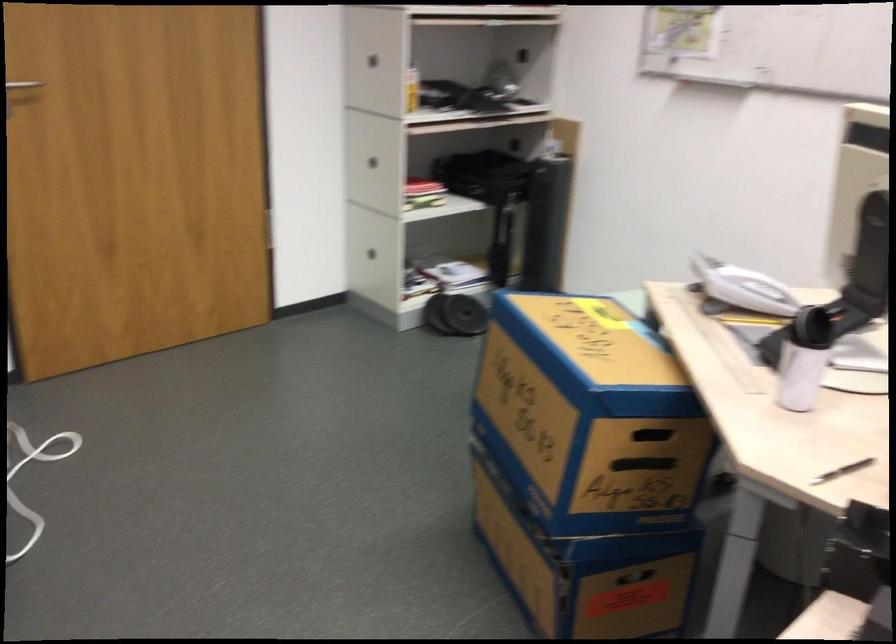
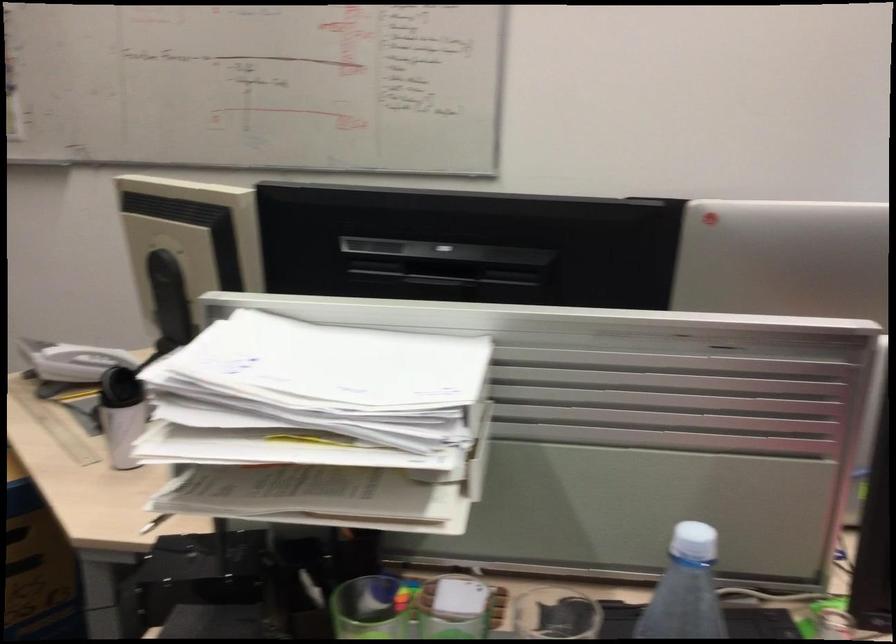
Where in the second image is the point corresponding to point (739, 281) from the first image?

(72, 361)